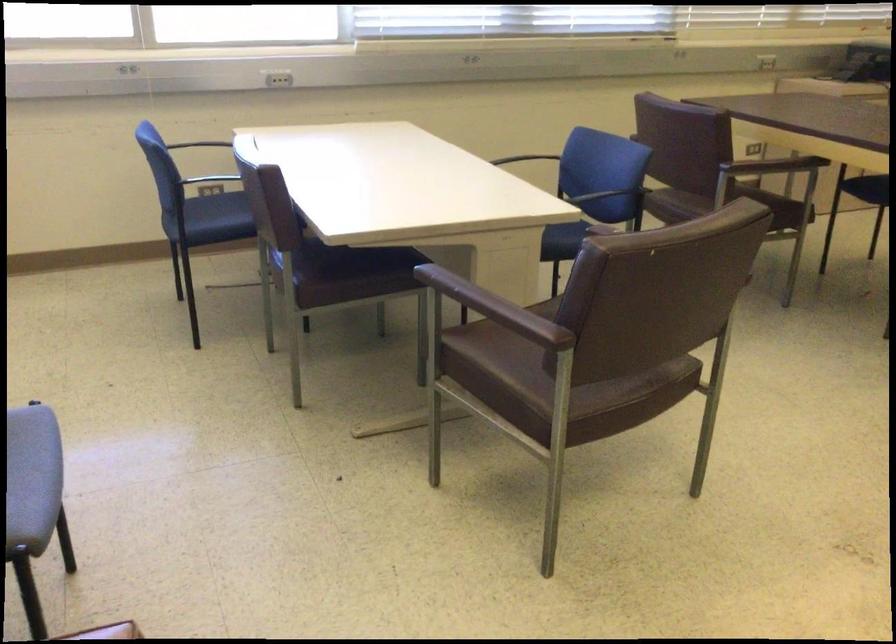
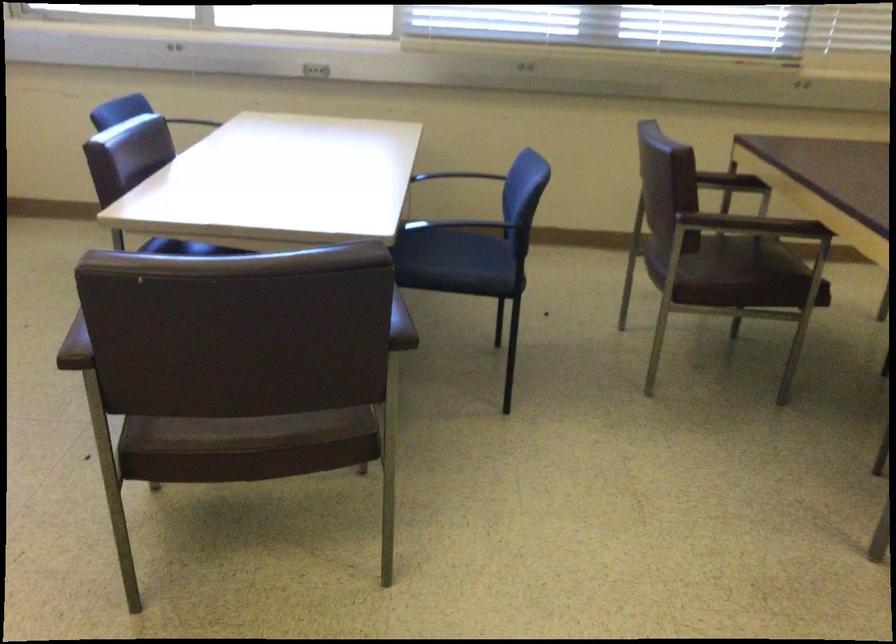
Locate, in the second image, the point that corresponds to (x=170, y=144) in the first image.

(202, 120)